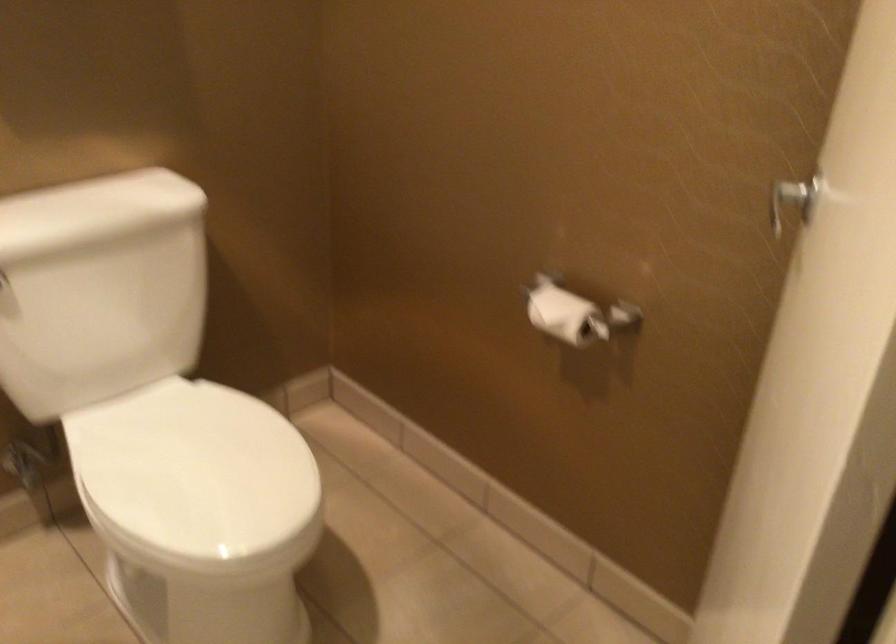
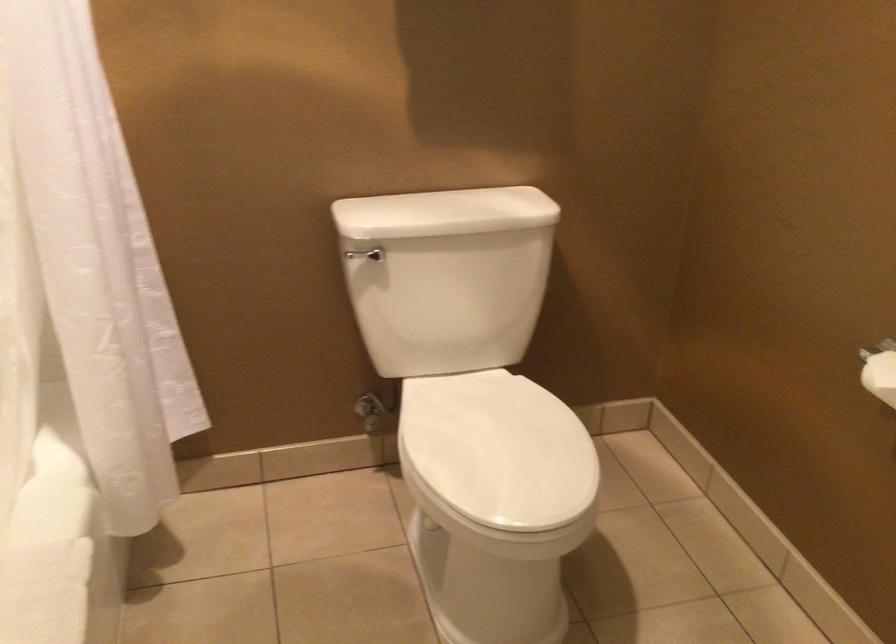
Question: What movement of the cameraman would produce the second image?

Choices:
 (A) Left
 (B) Right
 (C) Forward
 (D) Backward

Answer: (B)